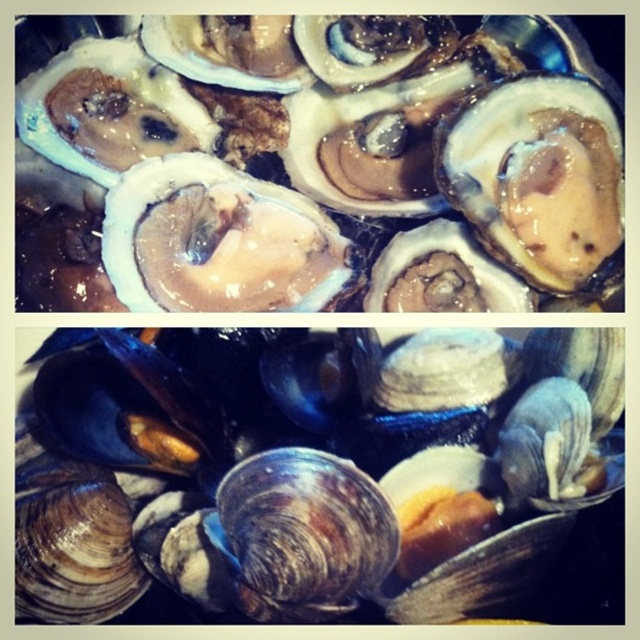
You are a seafood vendor who needs to arrange these items in a display. The customer wants to know which item is bigger between the shiny white oyster at center and the shiny brown shellfish at center. Which one should you point to?

The shiny white oyster at center is larger in size compared to the shiny brown shellfish at center, so you should point to the shiny white oyster at center.

You are a seafood vendor arranging a display. You have a shiny white oyster at center and a shiny brown shellfish at center. Which one should you place higher up to make them look balanced?

The shiny white oyster at center is taller than the shiny brown shellfish at center, so placing the shiny white oyster at center lower and the shiny brown shellfish at center higher would create a balanced appearance.

What is located at the point with coordinates (330,157) in this seafood display?

The point at coordinates (330,157) is where the shiny white oyster at center is located.